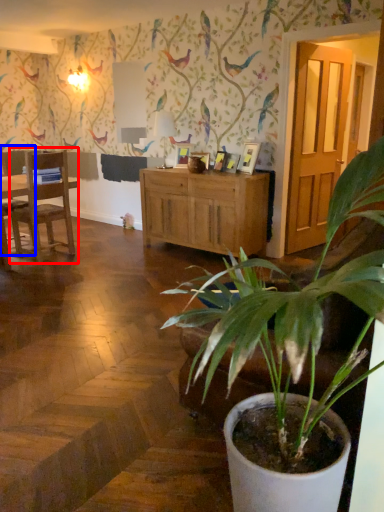
Question: Which object appears farthest to the camera in this image, chair (highlighted by a red box) or chair (highlighted by a blue box)?

Choices:
 (A) chair
 (B) chair

Answer: (B)